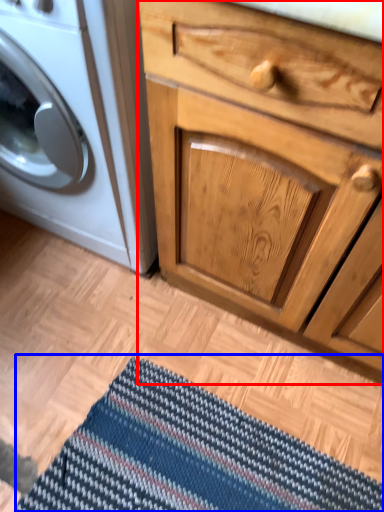
Question: Which point is closer to the camera, chest of drawers (highlighted by a red box) or doormat (highlighted by a blue box)?

Choices:
 (A) chest of drawers
 (B) doormat

Answer: (A)